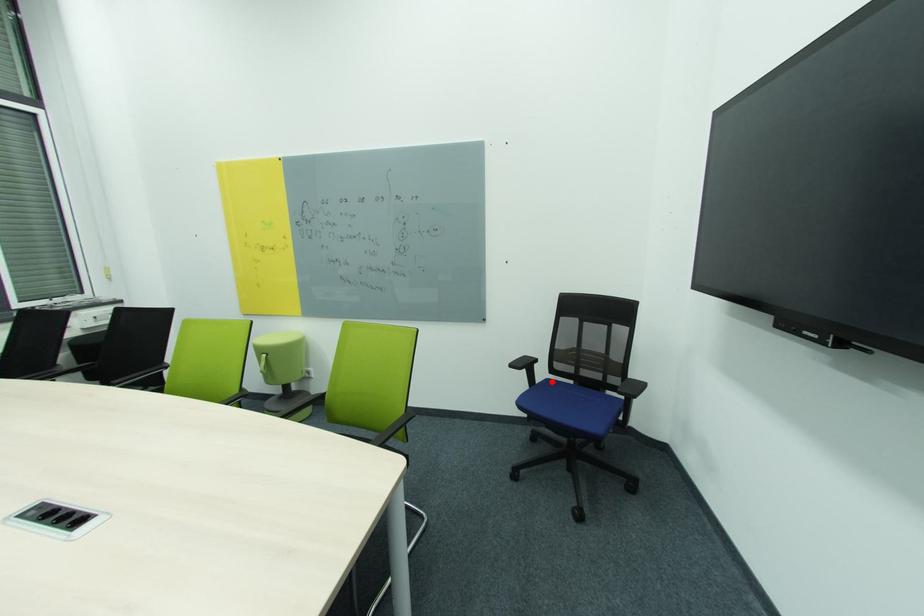
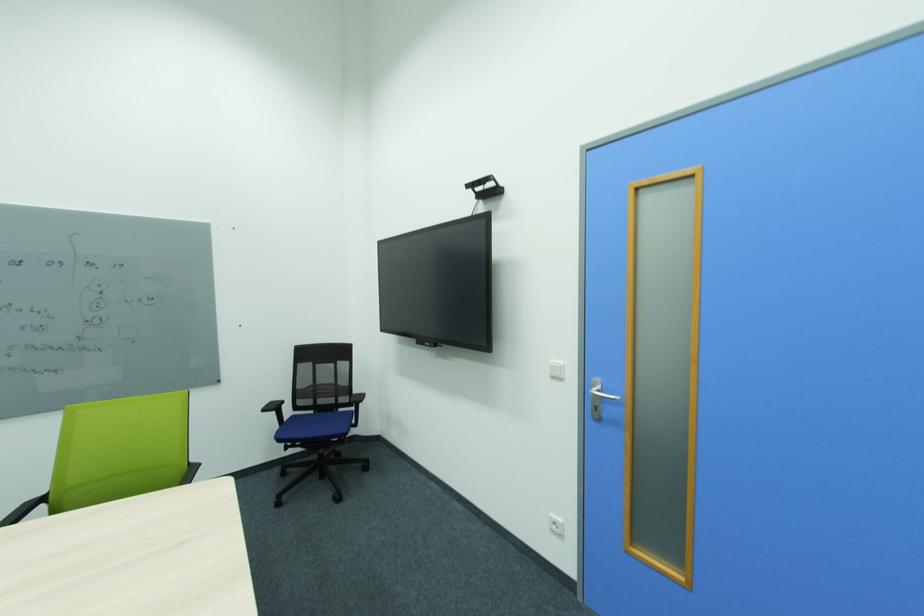
Where in the second image is the point corresponding to the highlighted location from the first image?

(297, 418)